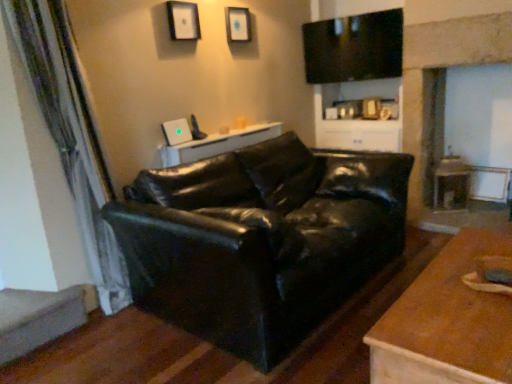
This screenshot has height=384, width=512. Identify the location of free space above wooden coffee table at lower right, the 2th table viewed from the top (from a real-world perspective). (464, 288).